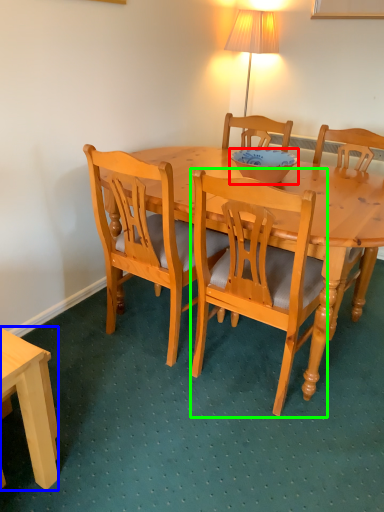
Question: Which object is the closest to the bowl (highlighted by a red box)? Choose among these: desk (highlighted by a blue box) or chair (highlighted by a green box).

Choices:
 (A) desk
 (B) chair

Answer: (B)